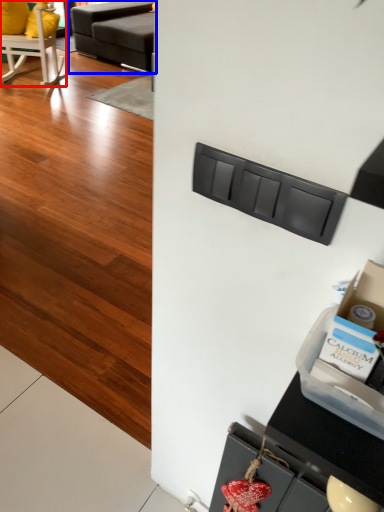
Question: Which point is closer to the camera, chair (highlighted by a red box) or studio couch (highlighted by a blue box)?

Choices:
 (A) chair
 (B) studio couch

Answer: (A)